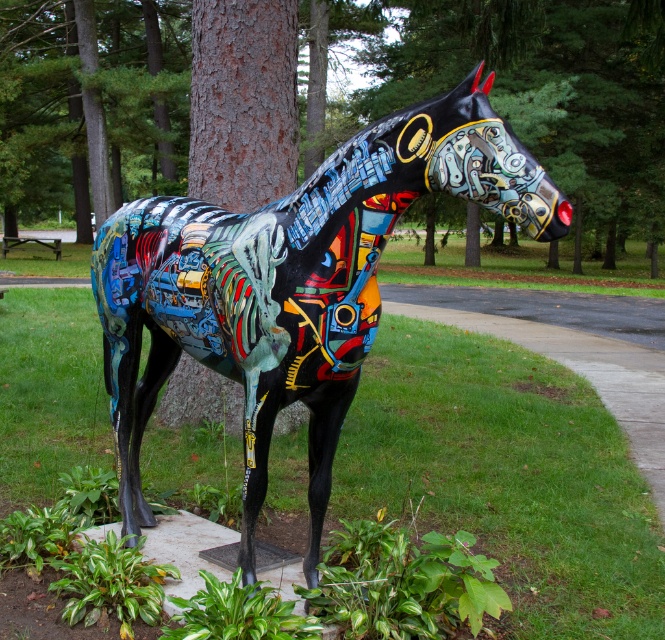
Image resolution: width=665 pixels, height=640 pixels. I want to click on metallic painted horse at center, so click(291, 285).

Looking at this image, is the position of metallic painted horse at center less distant than that of brown rough bark tree at center?

Yes, it is in front of brown rough bark tree at center.

Who is more distant from viewer, (x=283, y=308) or (x=255, y=29)?

The point (x=255, y=29) is more distant.

Where is `metallic painted horse at center`? This screenshot has width=665, height=640. metallic painted horse at center is located at coordinates pos(291,285).

Who is more forward, (x=499, y=1) or (x=249, y=451)?

Point (x=249, y=451) is more forward.

From the picture: Between brown textured tree trunk at center and metallic painted horse at center, which one is positioned higher?

brown textured tree trunk at center is above.

Is point (440, 52) more distant than point (416, 182)?

Yes, it is.

Identify the location of brown textured tree trunk at center. This screenshot has width=665, height=640. (517, 88).

Does brown textured tree trunk at center have a lesser height compared to brown rough bark tree at center?

Incorrect, brown textured tree trunk at center's height does not fall short of brown rough bark tree at center's.

Describe the element at coordinates (517, 88) in the screenshot. I see `brown textured tree trunk at center` at that location.

The image size is (665, 640). Find the location of `brown textured tree trunk at center`. brown textured tree trunk at center is located at coordinates (517, 88).